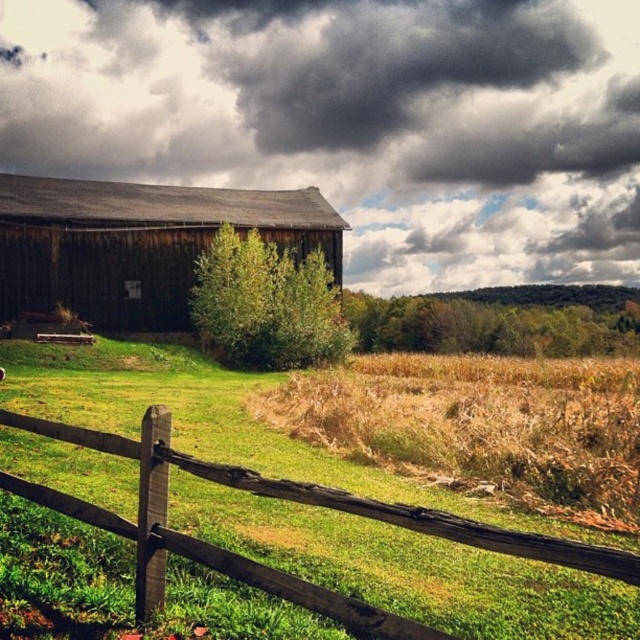
Based on the photo, you are a painter planning to paint the weathered wood barn at left and the brown wooden fence at lower left. You have a limited amount of paint. Which object requires more paint due to its larger surface area?

The weathered wood barn at left requires more paint because its width is larger than the brown wooden fence at lower left, indicating a greater surface area.

You are a painter standing in front of the scene. You want to paint the brown wooden fence at lower left first. Should you paint the weathered wood barn at left first or can you paint the fence first?

The brown wooden fence at lower left is behind the weathered wood barn at left, so you should paint the weathered wood barn at left first before painting the fence.

You are standing in the middle of the field looking at the weathered wood barn at left and the dark brown wooden barn at center. Which barn is closer to you?

The weathered wood barn at left is closer to you because it is in front of the dark brown wooden barn at center, which is positioned behind it.